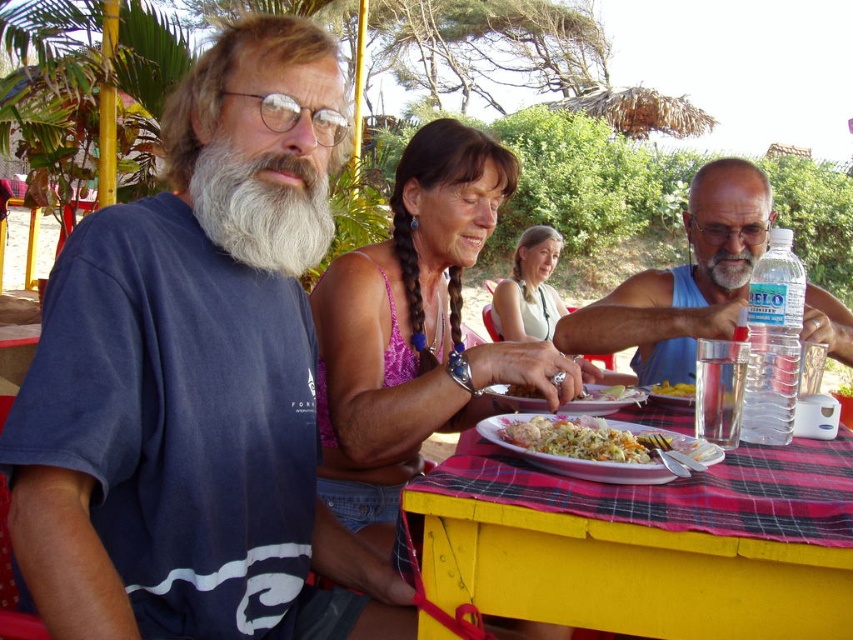
From the picture: Can you confirm if matte pink tank top at center is positioned below white rice at center?

No.

This screenshot has width=853, height=640. What do you see at coordinates (529, 289) in the screenshot? I see `matte pink tank top at center` at bounding box center [529, 289].

Identify the location of matte pink tank top at center. (529, 289).

Is gray matte beard at center below yellow matte pasta at center?

Incorrect, gray matte beard at center is not positioned below yellow matte pasta at center.

Which is behind, point (712, 253) or point (664, 396)?

The point (712, 253) is behind.

Find the location of a particular element. This screenshot has width=853, height=640. gray matte beard at center is located at coordinates (724, 268).

This screenshot has height=640, width=853. Identify the location of white matte beard at left. (262, 208).

Can you confirm if white matte beard at left is positioned below gray matte beard at center?

Actually, white matte beard at left is above gray matte beard at center.

Is point (245, 262) farther from viewer compared to point (729, 262)?

That is False.

Find the location of a particular element. The width and height of the screenshot is (853, 640). white matte beard at left is located at coordinates (262, 208).